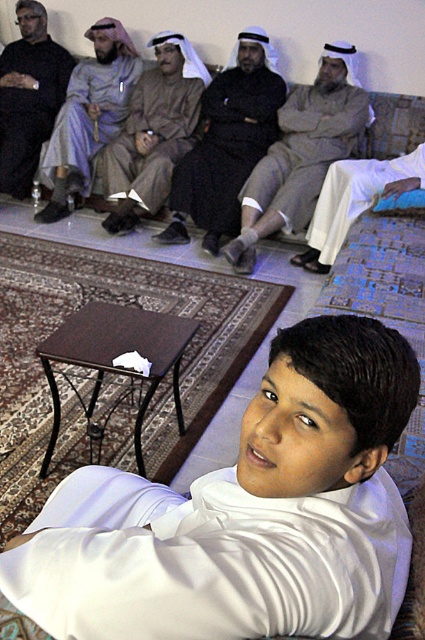
How distant is dark brown leather jacket at center from white cotton robe at lower right?

dark brown leather jacket at center and white cotton robe at lower right are 26.58 inches apart from each other.

Does dark brown leather jacket at center appear under white cotton robe at lower right?

No.

Between point (232, 93) and point (363, 164), which one is positioned in front?

Point (363, 164) is in front.

Locate an element on the screen. dark brown leather jacket at center is located at coordinates (226, 144).

Does point (209, 500) lie in front of point (317, 234)?

Yes.

Between point (175, 586) and point (350, 212), which one is positioned in front?

Point (175, 586)

Locate an element on the screen. The width and height of the screenshot is (425, 640). white satin shirt at center is located at coordinates (244, 513).

Does light brown fabric robe at center come behind dark matte clothing at left?

No.

Is light brown fabric robe at center below dark matte clothing at left?

Indeed, light brown fabric robe at center is positioned under dark matte clothing at left.

Is point (340, 45) behind point (40, 3)?

No, it is in front of (40, 3).

The height and width of the screenshot is (640, 425). In order to click on light brown fabric robe at center in this screenshot , I will do `click(300, 154)`.